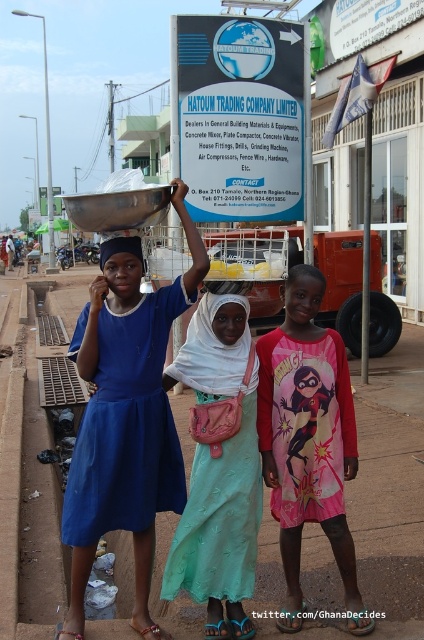
Consider the image. You are a photographer trying to capture a candid shot of both the pink cotton dress at center and the matte blue headscarf at center. Since you want to ensure both are in focus, which one should you focus on first to make sure the other is also in focus?

The pink cotton dress at center is in front of the matte blue headscarf at center. To ensure both are in focus, you should focus on the matte blue headscarf at center, as it is further back, allowing the depth of field to include the closer object as well.

You are a photographer taking a picture of the matte blue dress at left and the pink cotton dress at center. Which dress should you adjust your camera angle to focus on first if you want to capture both in the frame?

You should focus on the matte blue dress at left first because it is positioned to the left of the pink cotton dress at center, so adjusting the camera angle starting from the left ensures both dresses are captured in the frame.